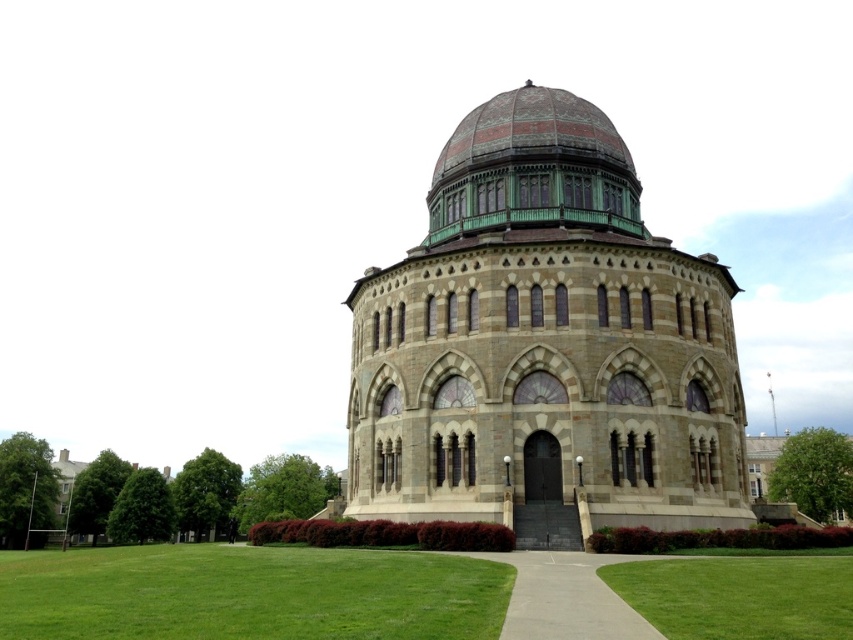
You are standing at the entrance of the observatory and see the green grass at lower center and the concrete at center. Which surface would be more likely to have a puddle of water after a rainstorm?

The concrete at center is less likely to have a puddle of water after a rainstorm because the green grass at lower center is much taller and can absorb more water.

Consider the image. You are a maintenance worker needing to reach the dome on the building from the green grass at lower center. The path is 15.68 meters long. If your equipment can only travel 10 meters, can you reach the dome?

The distance between you and the dome is 15.68 meters, which exceeds the equipment travel limit of 10 meters. Therefore, you cannot reach the dome with the current equipment.